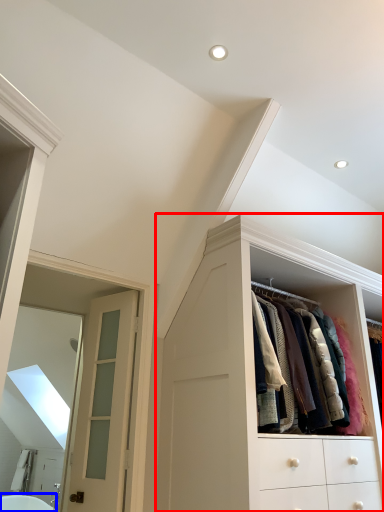
Question: Which point is closer to the camera, cabinetry (highlighted by a red box) or bath (highlighted by a blue box)?

Choices:
 (A) cabinetry
 (B) bath

Answer: (A)